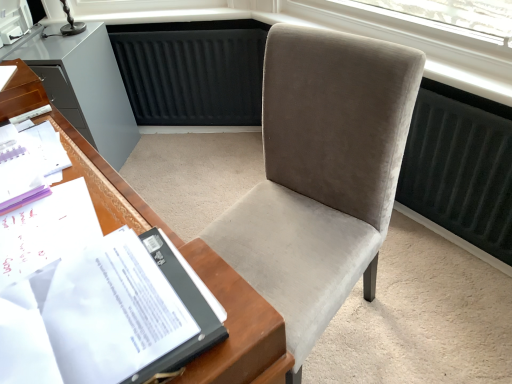
Question: Should I look upward or downward to see velvet gray chair at center?

Choices:
 (A) up
 (B) down

Answer: (B)

Question: Does white paper at left lie in front of velvet gray chair at center?

Choices:
 (A) no
 (B) yes

Answer: (A)

Question: Does white paper at left have a larger size compared to velvet gray chair at center?

Choices:
 (A) no
 (B) yes

Answer: (A)

Question: From the image's perspective, is white paper at left over velvet gray chair at center?

Choices:
 (A) no
 (B) yes

Answer: (B)

Question: Does white paper at left turn towards velvet gray chair at center?

Choices:
 (A) no
 (B) yes

Answer: (B)

Question: Is white paper at left looking in the opposite direction of velvet gray chair at center?

Choices:
 (A) yes
 (B) no

Answer: (B)

Question: Can you see white paper at left touching velvet gray chair at center?

Choices:
 (A) yes
 (B) no

Answer: (B)

Question: From the image's perspective, is white paper at left on top of matte gray cabinet at left?

Choices:
 (A) yes
 (B) no

Answer: (B)

Question: Does white paper at left turn towards matte gray cabinet at left?

Choices:
 (A) yes
 (B) no

Answer: (B)

Question: Could matte gray cabinet at left be considered to be inside white paper at left?

Choices:
 (A) yes
 (B) no

Answer: (B)

Question: From a real-world perspective, is white paper at left physically below matte gray cabinet at left?

Choices:
 (A) yes
 (B) no

Answer: (B)

Question: Does white paper at left have a lesser width compared to matte gray cabinet at left?

Choices:
 (A) yes
 (B) no

Answer: (A)

Question: Can you confirm if white paper at left is positioned to the left of matte gray cabinet at left?

Choices:
 (A) yes
 (B) no

Answer: (B)

Question: From a real-world perspective, is velvet gray chair at center on top of white paper at left?

Choices:
 (A) no
 (B) yes

Answer: (A)